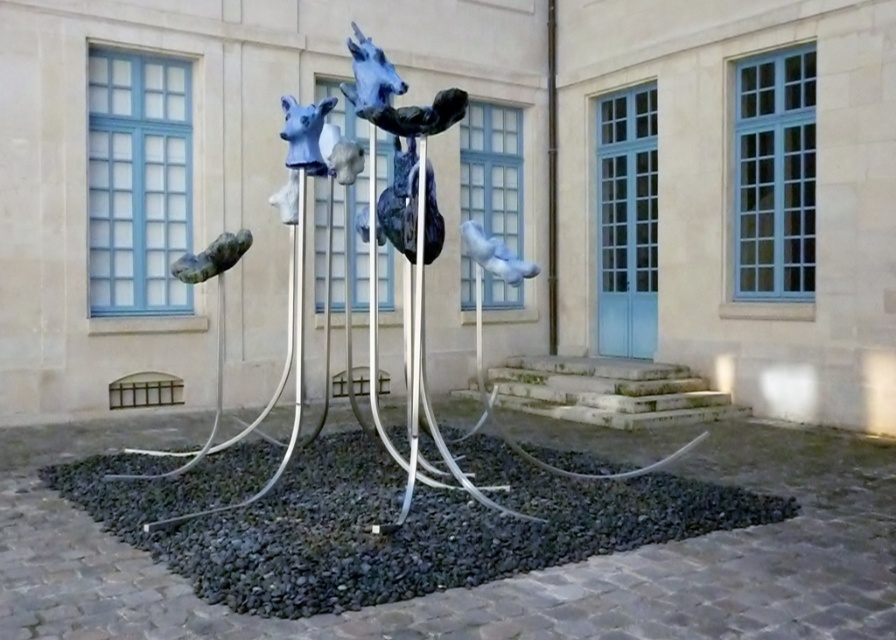
Is metallic blue horse heads at center above green matte sculpture at lower left?

No, metallic blue horse heads at center is not above green matte sculpture at lower left.

Does metallic blue horse heads at center have a lesser width compared to green matte sculpture at lower left?

No, metallic blue horse heads at center is not thinner than green matte sculpture at lower left.

The height and width of the screenshot is (640, 896). In order to click on metallic blue horse heads at center in this screenshot , I will do `click(479, 333)`.

Which of these two, matte blue bird at center or green matte sculpture at lower left, stands shorter?

green matte sculpture at lower left is shorter.

Which is above, matte blue bird at center or green matte sculpture at lower left?

matte blue bird at center

Does point (497, 237) come behind point (214, 244)?

Yes.

Locate an element on the screen. matte blue bird at center is located at coordinates (495, 256).

Can you confirm if metallic blue horse heads at center is shorter than matte blue bird at center?

No.

Between point (653, 465) and point (510, 282), which one is positioned behind?

Point (653, 465)

I want to click on metallic blue horse heads at center, so click(479, 333).